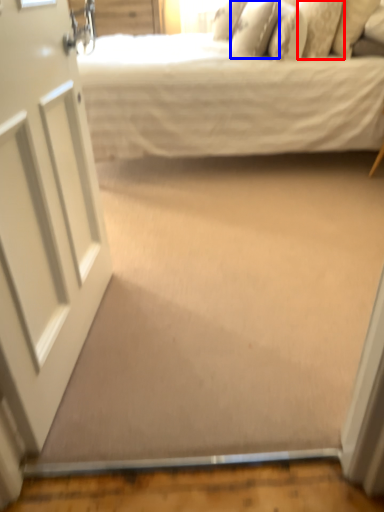
Question: Which object appears closest to the camera in this image, pillow (highlighted by a red box) or pillow (highlighted by a blue box)?

Choices:
 (A) pillow
 (B) pillow

Answer: (A)